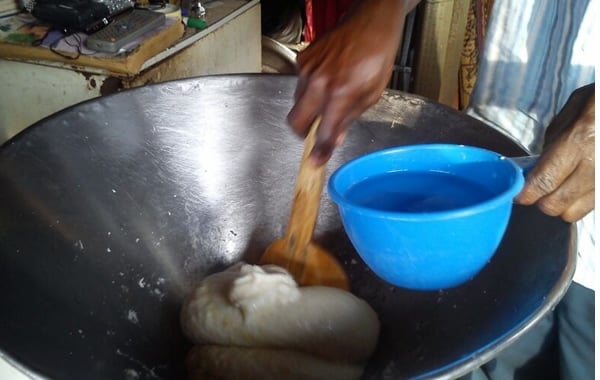
Locate an element on the screen. The image size is (600, 380). wall is located at coordinates pos(443,66), pos(449,73).